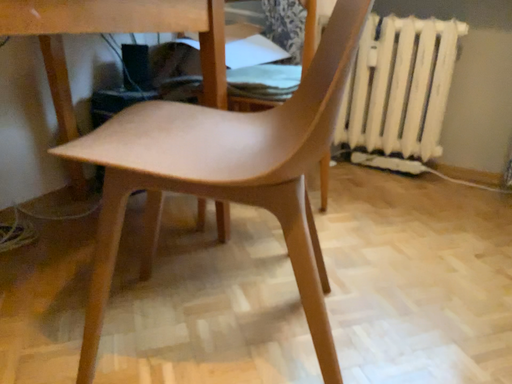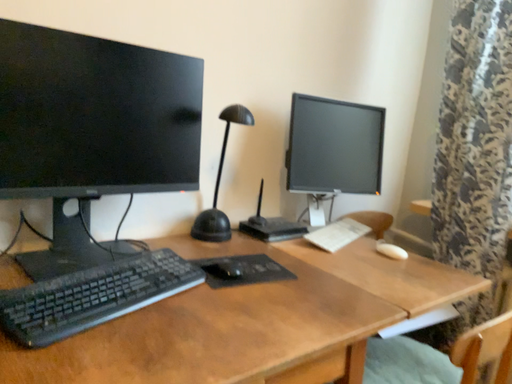
Question: Which way did the camera rotate in the video?

Choices:
 (A) rotated left
 (B) rotated right

Answer: (A)